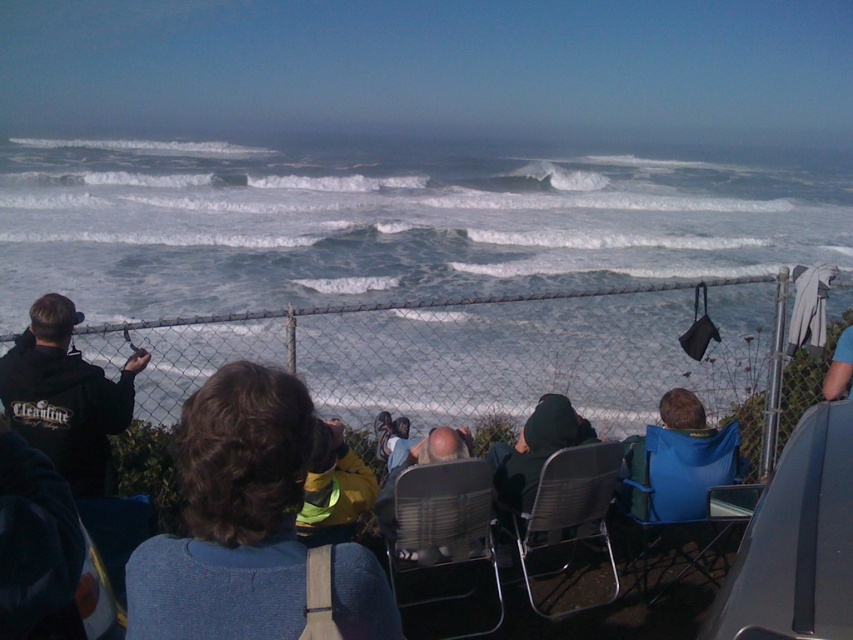
Question: Which object is the closest to the blue fabric chair at lower right?

Choices:
 (A) blue fabric at center
 (B) matte black chair at center
 (C) black matte jacket at left

Answer: (B)

Question: Can you confirm if blue fabric at center is thinner than black matte jacket at left?

Choices:
 (A) yes
 (B) no

Answer: (A)

Question: Is black matte jacket at left smaller than yellow fabric at center?

Choices:
 (A) no
 (B) yes

Answer: (A)

Question: Does blue fabric at center appear on the right side of yellow fabric at center?

Choices:
 (A) no
 (B) yes

Answer: (B)

Question: Which object appears closest to the camera in this image?

Choices:
 (A) dark green fabric jacket at center
 (B) blue fabric at center
 (C) black matte jacket at left
 (D) blue fabric chair at lower right

Answer: (B)

Question: Considering the real-world distances, which object is closest to the black matte jacket at left?

Choices:
 (A) blue fabric at center
 (B) yellow fabric at center
 (C) black mesh chair at center

Answer: (B)